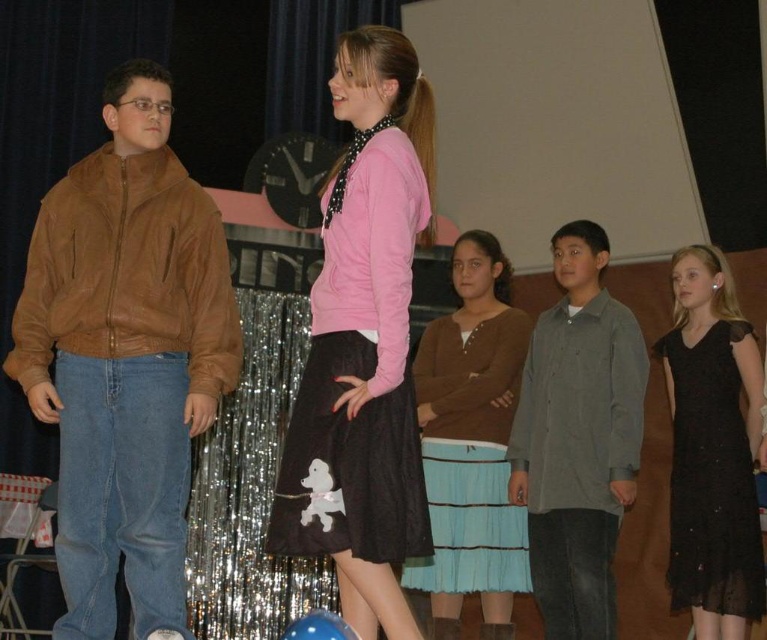
Question: Does brown leather jacket at left have a greater width compared to blue striped skirt at center?

Choices:
 (A) no
 (B) yes

Answer: (B)

Question: Which of the following is the farthest from the observer?

Choices:
 (A) (301, 483)
 (B) (321, 632)
 (C) (492, 422)

Answer: (C)

Question: Is the position of brown leather jacket at left more distant than that of gray cotton shirt at center?

Choices:
 (A) no
 (B) yes

Answer: (A)

Question: Which point is farther to the camera?

Choices:
 (A) blue striped skirt at center
 (B) brown leather jacket at left

Answer: (A)

Question: Where is black lace dress at right located in relation to blue glossy balloon at lower center in the image?

Choices:
 (A) below
 (B) above

Answer: (B)

Question: Which point is closer to the camera taking this photo?

Choices:
 (A) (733, 499)
 (B) (551, 420)
 (C) (518, 556)

Answer: (A)